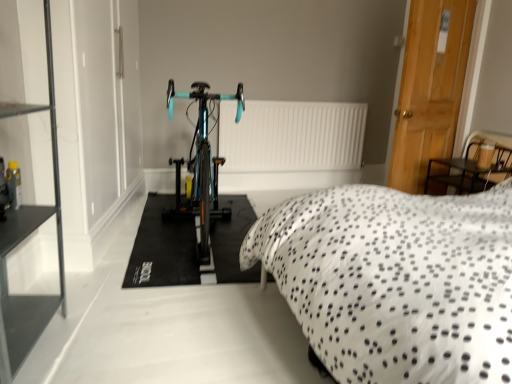
Question: Is teal glossy bicycle at center touching white dotted fabric at center?

Choices:
 (A) no
 (B) yes

Answer: (A)

Question: From a real-world perspective, is teal glossy bicycle at center physically below white dotted fabric at center?

Choices:
 (A) no
 (B) yes

Answer: (B)

Question: Is teal glossy bicycle at center thinner than white dotted fabric at center?

Choices:
 (A) yes
 (B) no

Answer: (A)

Question: Could you tell me if teal glossy bicycle at center is facing white dotted fabric at center?

Choices:
 (A) no
 (B) yes

Answer: (A)

Question: Can we say teal glossy bicycle at center lies outside white dotted fabric at center?

Choices:
 (A) yes
 (B) no

Answer: (A)

Question: Considering the relative sizes of teal glossy bicycle at center and white dotted fabric at center in the image provided, is teal glossy bicycle at center shorter than white dotted fabric at center?

Choices:
 (A) no
 (B) yes

Answer: (B)

Question: Is teal glossy bicycle at center in front of wooden door at right?

Choices:
 (A) no
 (B) yes

Answer: (B)

Question: Is teal glossy bicycle at center positioned far away from wooden door at right?

Choices:
 (A) no
 (B) yes

Answer: (B)

Question: Considering the relative sizes of teal glossy bicycle at center and wooden door at right in the image provided, is teal glossy bicycle at center smaller than wooden door at right?

Choices:
 (A) yes
 (B) no

Answer: (A)

Question: Considering the relative sizes of teal glossy bicycle at center and wooden door at right in the image provided, is teal glossy bicycle at center shorter than wooden door at right?

Choices:
 (A) yes
 (B) no

Answer: (A)

Question: Can you confirm if teal glossy bicycle at center is thinner than wooden door at right?

Choices:
 (A) no
 (B) yes

Answer: (A)

Question: Can we say teal glossy bicycle at center lies outside wooden door at right?

Choices:
 (A) yes
 (B) no

Answer: (A)

Question: From the image's perspective, is white dotted fabric at center beneath teal glossy bicycle at center?

Choices:
 (A) no
 (B) yes

Answer: (B)